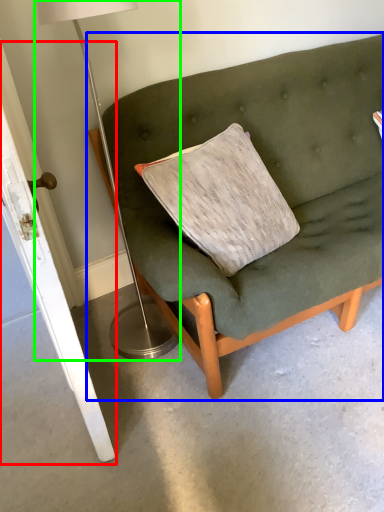
Question: Estimate the real-world distances between objects in this image. Which object is closer to door (highlighted by a red box), studio couch (highlighted by a blue box) or table lamp (highlighted by a green box)?

Choices:
 (A) studio couch
 (B) table lamp

Answer: (B)